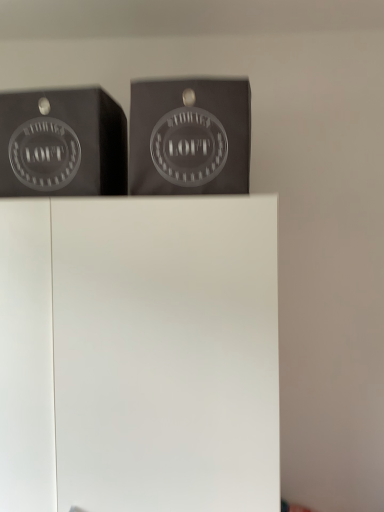
Locate an element on the screen. The image size is (384, 512). white matte cabinet at center is located at coordinates (140, 355).

Measure the distance between point (124, 116) and camera.

Point (124, 116) and camera are 3.85 feet apart.

What do you see at coordinates (190, 137) in the screenshot?
I see `matte black box at upper center` at bounding box center [190, 137].

Locate an element on the screen. The image size is (384, 512). white matte cabinet at center is located at coordinates (140, 355).

Considering the sizes of objects matte black box at upper center and matte black logo at upper left in the image provided, who is thinner, matte black box at upper center or matte black logo at upper left?

matte black box at upper center.

Can you see matte black box at upper center touching matte black logo at upper left?

No, matte black box at upper center is not making contact with matte black logo at upper left.

This screenshot has width=384, height=512. Find the location of `writing that is behind the matte black box at upper center`. writing that is behind the matte black box at upper center is located at coordinates [62, 144].

From the image's perspective, is matte black box at upper center below matte black logo at upper left?

Correct, matte black box at upper center appears lower than matte black logo at upper left in the image.

Would you say white matte cabinet at center contains matte black box at upper center?

Definitely not — matte black box at upper center is not inside white matte cabinet at center.

Is point (257, 223) closer to camera compared to point (209, 119)?

Yes, point (257, 223) is closer to viewer.

From a real-world perspective, is white matte cabinet at center located higher than matte black box at upper center?

No, from a real-world perspective, white matte cabinet at center is not on top of matte black box at upper center.

From a real-world perspective, which object rests below the other?

white matte cabinet at center, from a real-world perspective.

Looking at this image, what's the angular difference between matte black logo at upper left and white matte cabinet at center's facing directions?

7.1 degrees separate the facing orientations of matte black logo at upper left and white matte cabinet at center.

Considering the relative positions of matte black logo at upper left and white matte cabinet at center in the image provided, is matte black logo at upper left to the left or to the right of white matte cabinet at center?

In the image, matte black logo at upper left appears on the left side of white matte cabinet at center.

Locate an element on the screen. The height and width of the screenshot is (512, 384). furniture that appears in front of the matte black logo at upper left is located at coordinates (140, 355).

Can you confirm if matte black logo at upper left is shorter than matte black box at upper center?

Indeed, matte black logo at upper left has a lesser height compared to matte black box at upper center.

From a real-world perspective, between matte black logo at upper left and matte black box at upper center, who is vertically lower?

From a 3D spatial view, matte black box at upper center is below.

From the picture: Is matte black logo at upper left behind matte black box at upper center?

Yes, the depth of matte black logo at upper left is greater than that of matte black box at upper center.

Could you tell me if matte black logo at upper left is turned towards matte black box at upper center?

No, matte black logo at upper left is not facing towards matte black box at upper center.

How many degrees apart are the facing directions of white matte cabinet at center and matte black logo at upper left?

The angle between the facing direction of white matte cabinet at center and the facing direction of matte black logo at upper left is 7.1 degrees.

Is white matte cabinet at center inside or outside of matte black logo at upper left?

white matte cabinet at center is located beyond the bounds of matte black logo at upper left.

Where is `furniture in front of the matte black logo at upper left`? furniture in front of the matte black logo at upper left is located at coordinates (140, 355).

From a real-world perspective, relative to matte black logo at upper left, is white matte cabinet at center vertically above or below?

Clearly, from a real-world perspective, white matte cabinet at center is below matte black logo at upper left.

From a real-world perspective, is matte black box at upper center positioned under white matte cabinet at center based on gravity?

No, from a real-world perspective, matte black box at upper center is not under white matte cabinet at center.

Is matte black box at upper center inside or outside of white matte cabinet at center?

matte black box at upper center is spatially situated outside white matte cabinet at center.

From the image's perspective, does matte black box at upper center appear lower than white matte cabinet at center?

No, from the image's perspective, matte black box at upper center is not below white matte cabinet at center.

This screenshot has width=384, height=512. Identify the location of package located below the matte black logo at upper left (from the image's perspective). (190, 137).

The image size is (384, 512). I want to click on package above the white matte cabinet at center (from a real-world perspective), so click(190, 137).

In the scene shown: When comparing their distances from matte black logo at upper left, does matte black box at upper center or white matte cabinet at center seem further?

The object further to matte black logo at upper left is white matte cabinet at center.

Which object lies further to the anchor point matte black box at upper center, matte black logo at upper left or white matte cabinet at center?

Based on the image, white matte cabinet at center appears to be further to matte black box at upper center.

Consider the image. Considering their positions, is matte black box at upper center positioned further to white matte cabinet at center than matte black logo at upper left?

matte black logo at upper left is further to white matte cabinet at center.

Looking at the image, which one is located further to matte black logo at upper left, white matte cabinet at center or matte black box at upper center?

Based on the image, white matte cabinet at center appears to be further to matte black logo at upper left.

Estimate the real-world distances between objects in this image. Which object is closer to white matte cabinet at center, matte black logo at upper left or matte black box at upper center?

Among the two, matte black box at upper center is located nearer to white matte cabinet at center.

From the image, which object appears to be farther from matte black box at upper center, white matte cabinet at center or matte black logo at upper left?

white matte cabinet at center is positioned further to the anchor matte black box at upper center.

You are a GUI agent. You are given a task and a screenshot of the screen. Output one action in this format:
    pyautogui.click(x=<x>, y=<y>)
    Task: Click on the package between matte black logo at upper left and white matte cabinet at center in the vertical direction
    The image size is (384, 512).
    Given the screenshot: What is the action you would take?
    pyautogui.click(x=190, y=137)